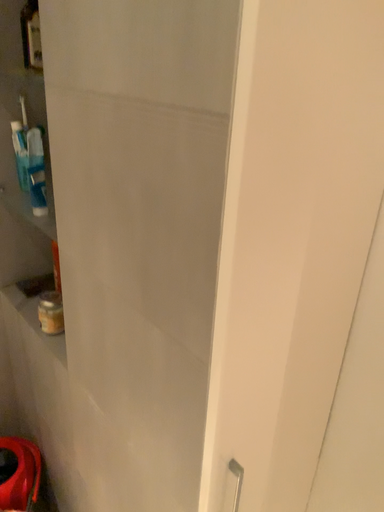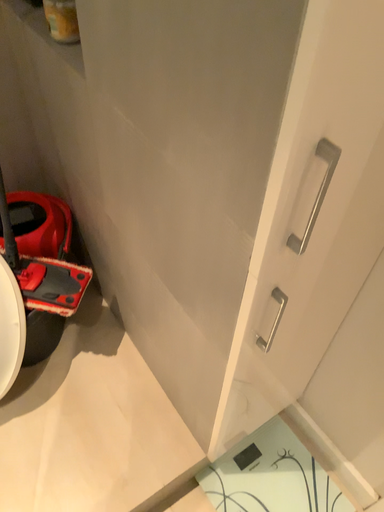
Question: Which way did the camera rotate in the video?

Choices:
 (A) rotated downward
 (B) rotated upward

Answer: (A)